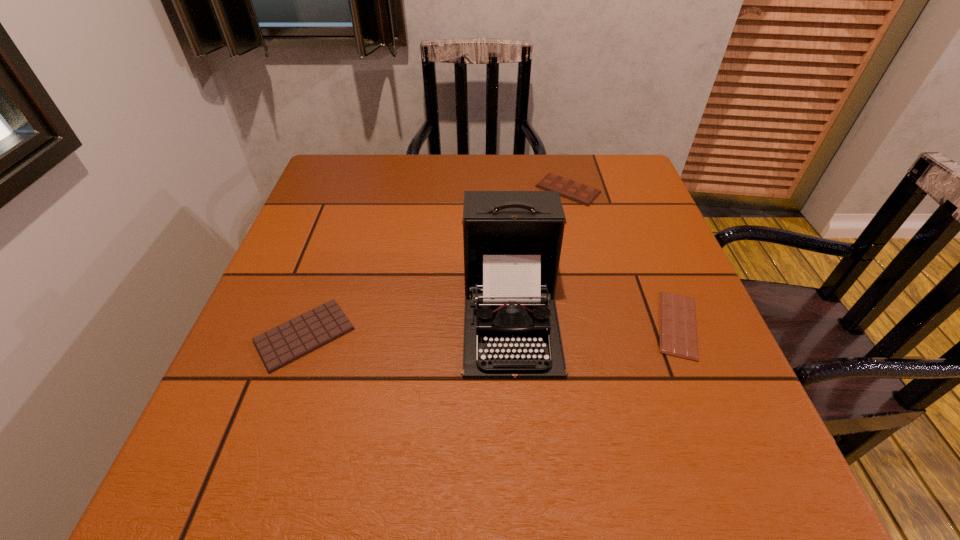
Locate an element on the screen. Image resolution: width=960 pixels, height=540 pixels. vacant area at the near right corner of the desktop is located at coordinates (732, 481).

Image resolution: width=960 pixels, height=540 pixels. I want to click on empty location between the farthest chocolate bar and the shortest object, so click(623, 257).

Where is `empty location between the shortest object and the second chocolate bar from left to right`? empty location between the shortest object and the second chocolate bar from left to right is located at coordinates (623, 257).

You are a GUI agent. You are given a task and a screenshot of the screen. Output one action in this format:
    pyautogui.click(x=<x>, y=<y>)
    Task: Click on the blank region between the third tallest object and the tallest object
    The width and height of the screenshot is (960, 540).
    Given the screenshot: What is the action you would take?
    pyautogui.click(x=408, y=325)

You are a GUI agent. You are given a task and a screenshot of the screen. Output one action in this format:
    pyautogui.click(x=<x>, y=<y>)
    Task: Click on the unoccupied area between the second tallest chocolate bar and the typewriter
    
    Given the screenshot: What is the action you would take?
    pyautogui.click(x=408, y=325)

The image size is (960, 540). I want to click on vacant point located between the leftmost chocolate bar and the typewriter, so click(x=408, y=325).

Locate which object ranks in proximity to the second tallest object. Please provide its 2D coordinates. Your answer should be formatted as a tuple, i.e. [(x, y)], where the tuple contains the x and y coordinates of a point satisfying the conditions above.

[(512, 240)]

Select which object appears as the second closest to the third shortest object. Please provide its 2D coordinates. Your answer should be formatted as a tuple, i.e. [(x, y)], where the tuple contains the x and y coordinates of a point satisfying the conditions above.

[(678, 329)]

At what (x,y) coordinates should I click in order to perform the action: click on chocolate bar that is the second closest to the third tallest object. Please return your answer as a coordinate pair (x, y). This screenshot has width=960, height=540. Looking at the image, I should click on (678, 329).

Where is `the third closest chocolate bar to the typewriter`? The width and height of the screenshot is (960, 540). the third closest chocolate bar to the typewriter is located at coordinates (282, 345).